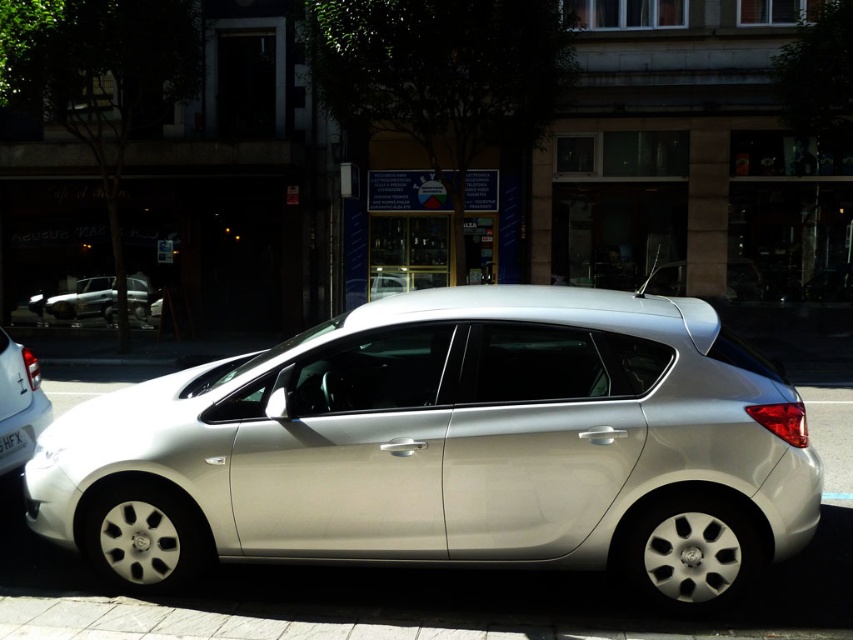
Question: Which of the following is the farthest from the observer?

Choices:
 (A) silver metallic hatchback at center
 (B) satin silver car at center
 (C) silver metallic hatchback at lower left
 (D) white plastic license plate at center

Answer: (A)

Question: Which of the following is the farthest from the observer?

Choices:
 (A) (99, 278)
 (B) (25, 429)

Answer: (A)

Question: Can you confirm if satin silver car at center is positioned to the left of white plastic license plate at center?

Choices:
 (A) yes
 (B) no

Answer: (B)

Question: Which point is farther from the camera taking this photo?

Choices:
 (A) (1, 456)
 (B) (383, 520)
 (C) (39, 296)
 (D) (18, 371)

Answer: (C)

Question: Is satin silver car at center closer to the viewer compared to silver metallic hatchback at center?

Choices:
 (A) yes
 (B) no

Answer: (A)

Question: Is satin silver car at center wider than silver metallic hatchback at lower left?

Choices:
 (A) no
 (B) yes

Answer: (B)